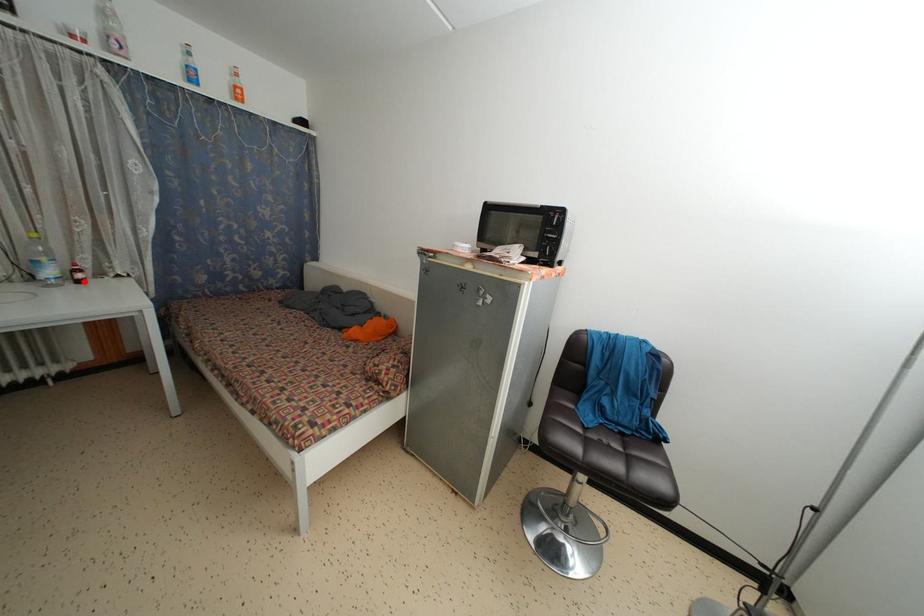
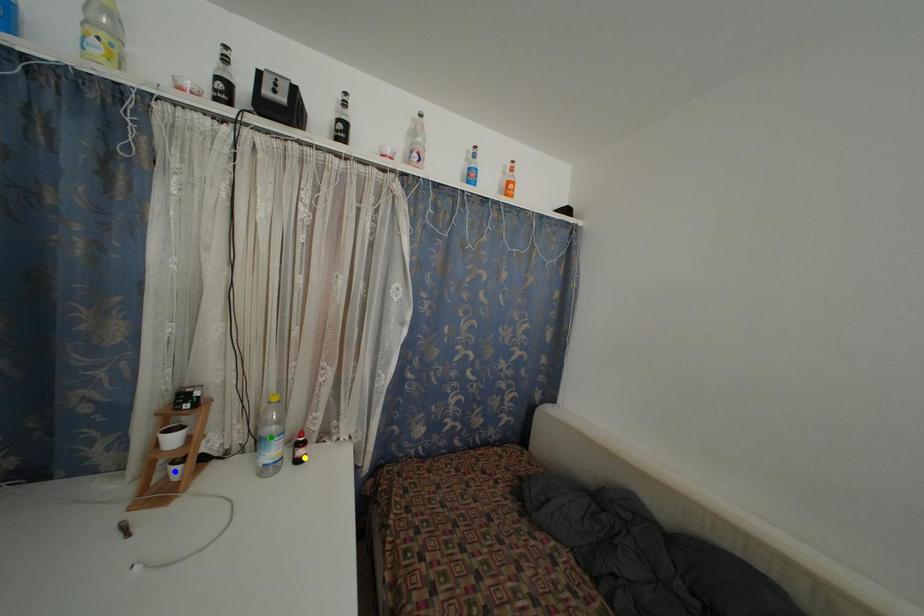
Question: I am providing you with two images of the same scene from different viewpoints. A red point is marked on the first image. You are given multiple points on the second image. Which point in image 2 represents the same 3d spot as the red point in image 1?

Choices:
 (A) green point
 (B) blue point
 (C) yellow point

Answer: (C)